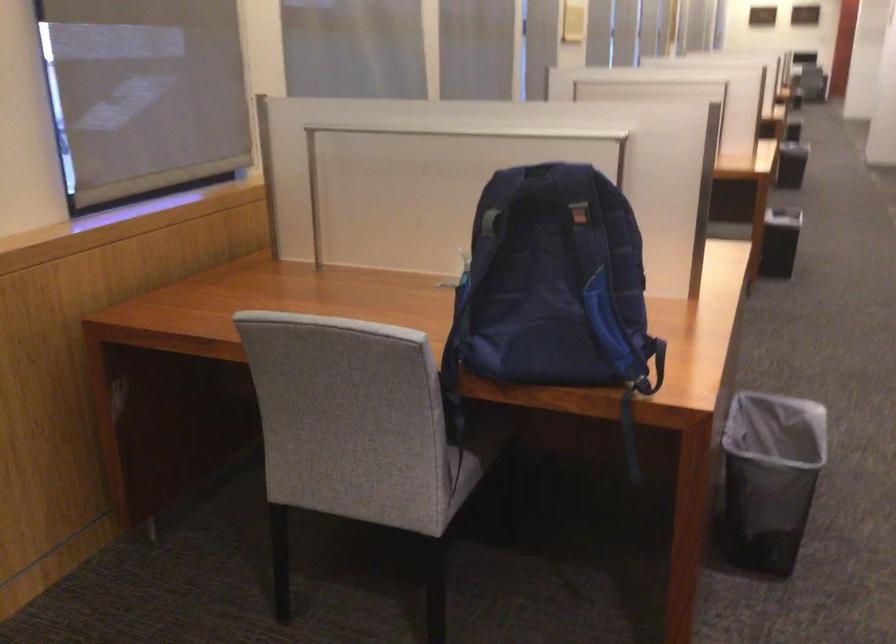
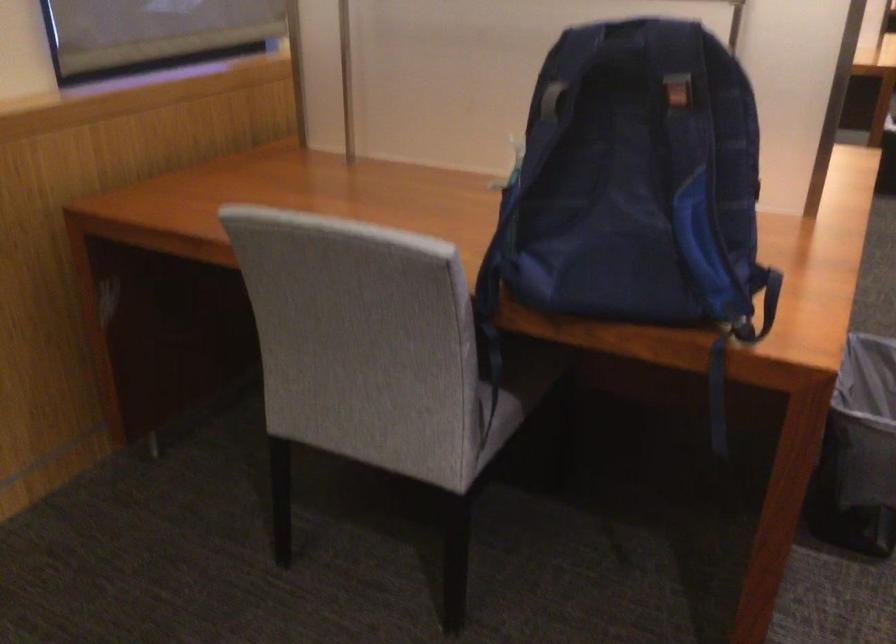
In the second image, find the point that corresponds to (x=629, y=436) in the first image.

(718, 395)